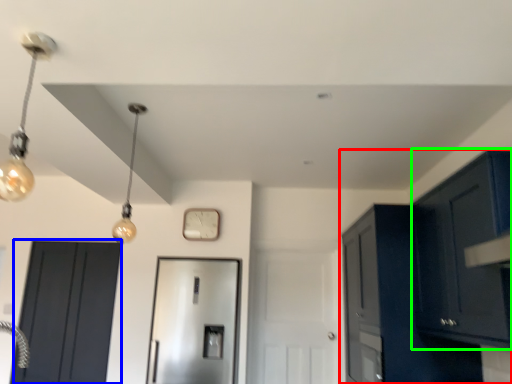
Question: Which object is positioned farthest from cabinetry (highlighted by a red box)? Select from door (highlighted by a blue box) and cabinetry (highlighted by a green box).

Choices:
 (A) door
 (B) cabinetry

Answer: (A)